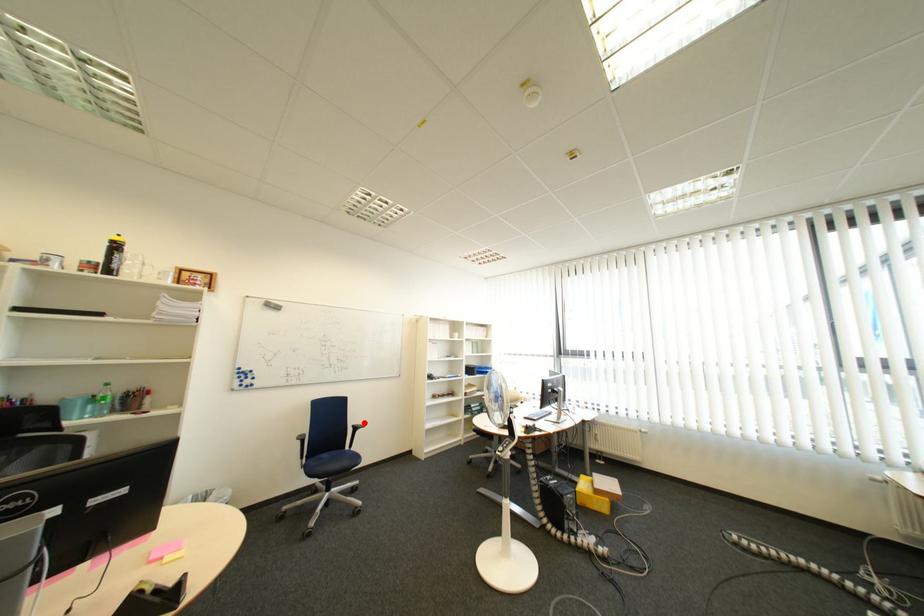
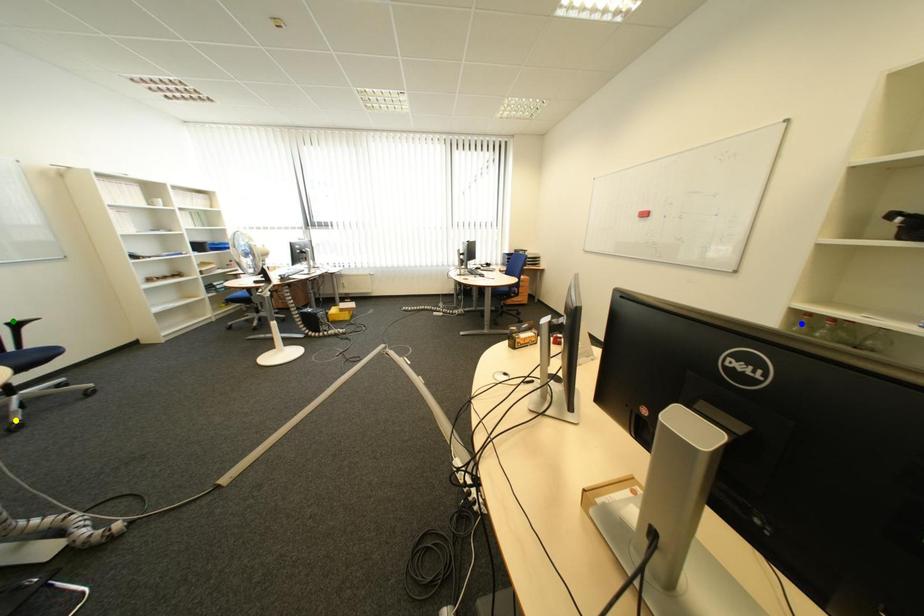
Question: I am providing you with two images of the same scene from different viewpoints. A red point is marked on the first image. You are given multiple points on the second image. In image 2, which mark is for the same physical point as the one in image 1?

Choices:
 (A) yellow point
 (B) blue point
 (C) green point

Answer: (C)